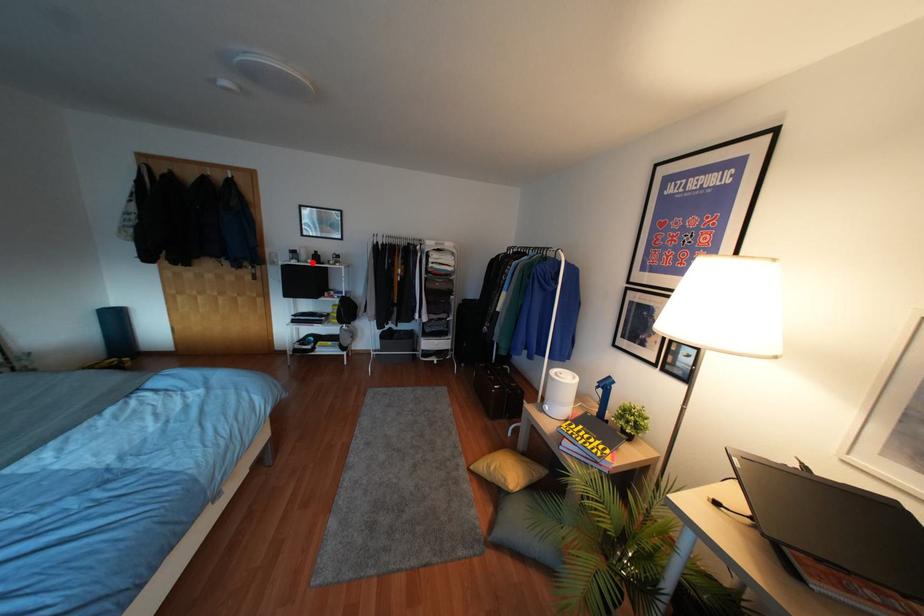
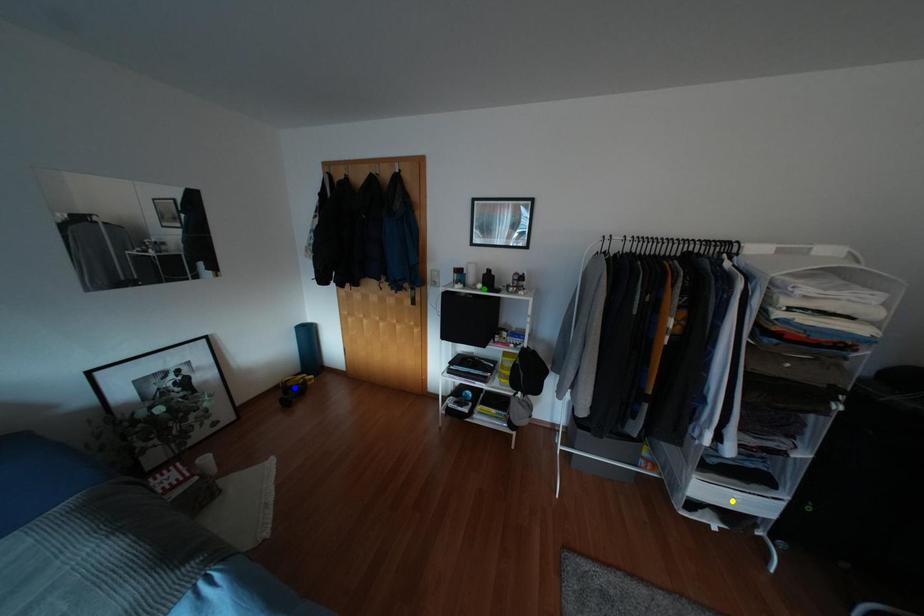
Question: I am providing you with two images of the same scene from different viewpoints. A red point is marked on the first image. You are given multiple points on the second image. Can you choose the point in image 2 that corresponds to the point in image 1?

Choices:
 (A) blue point
 (B) yellow point
 (C) green point

Answer: (C)